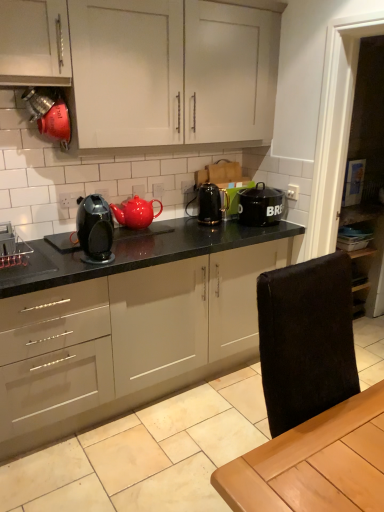
What are the coordinates of `vacant area that lies in front of matte black coffee maker at center` in the screenshot? It's located at (67, 271).